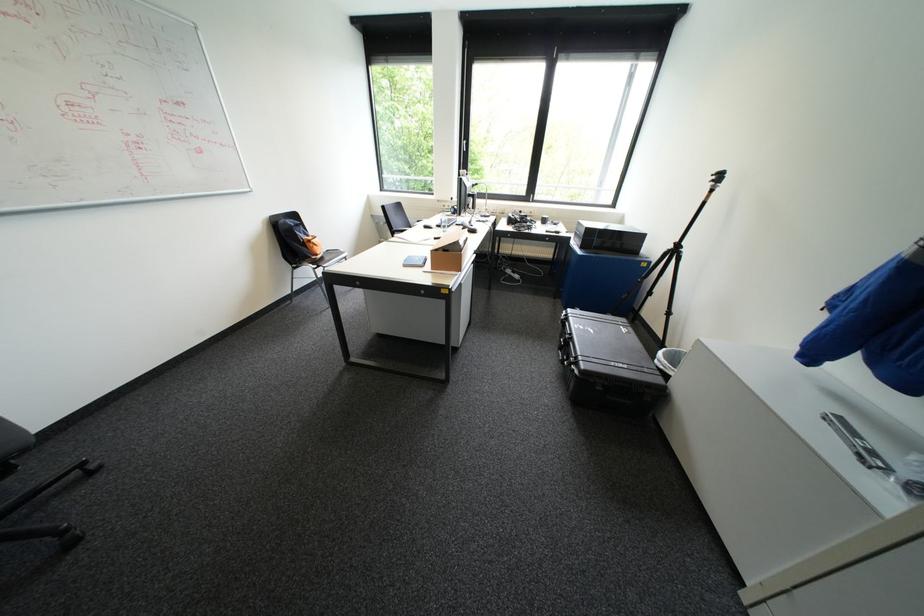
Which object does [447,252] point to?

It corresponds to the cardboard box in the image.